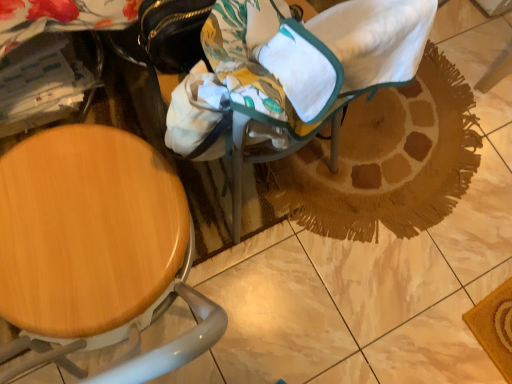
Locate an element on the screen. vacant point to the right of wooden seat at left is located at coordinates (260, 311).